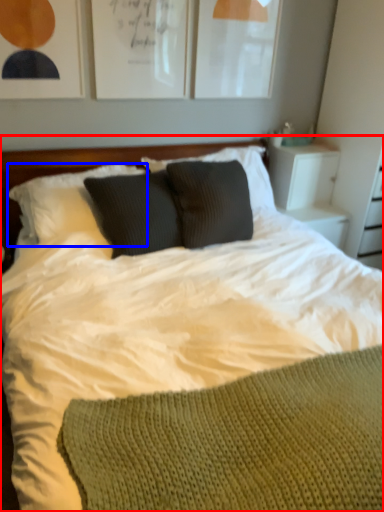
Question: Which point is further to the camera, bed (highlighted by a red box) or pillow (highlighted by a blue box)?

Choices:
 (A) bed
 (B) pillow

Answer: (B)